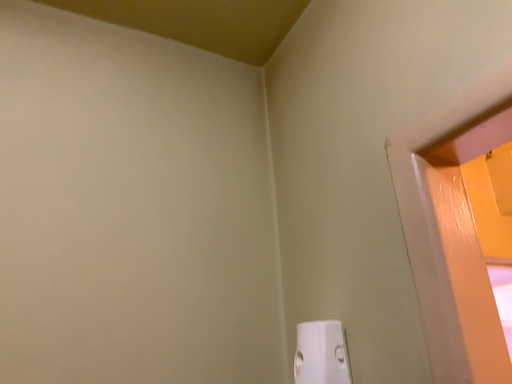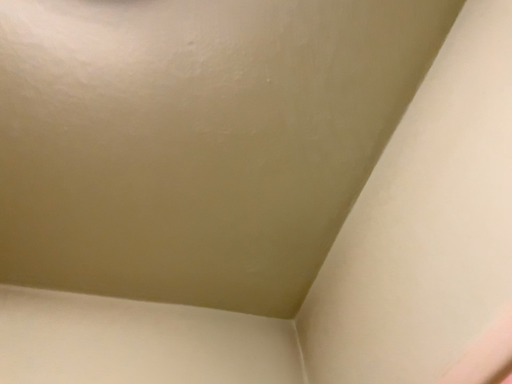
Question: Which way did the camera rotate in the video?

Choices:
 (A) rotated right
 (B) rotated left

Answer: (B)